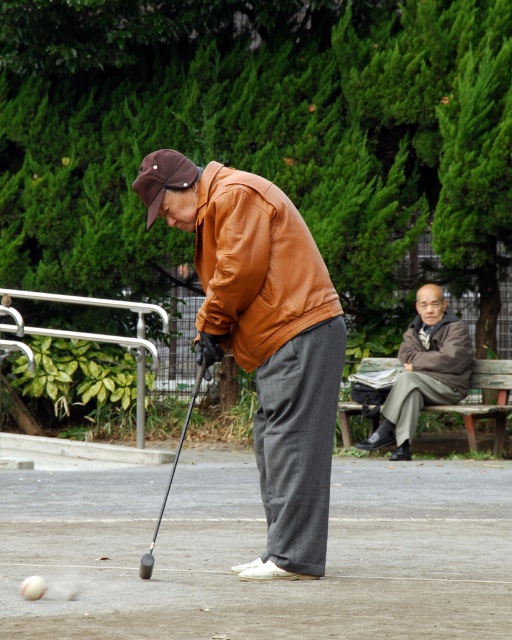
Question: Estimate the real-world distances between objects in this image. Which object is closer to the wooden bench at center right?

Choices:
 (A) brown leather jacket at right
 (B) brown leather jacket at center
 (C) gray fabric jacket at upper right
 (D) black rubber golf club at lower center

Answer: (A)

Question: Which point is farther from the camera taking this photo?

Choices:
 (A) (160, 509)
 (B) (27, 596)
 (C) (209, 253)
 (D) (430, 355)

Answer: (D)

Question: Can you confirm if wooden bench at center right is smaller than black rubber golf club at lower center?

Choices:
 (A) no
 (B) yes

Answer: (B)

Question: Is wooden bench at center right positioned in front of brown leather jacket at right?

Choices:
 (A) yes
 (B) no

Answer: (A)

Question: Which object is farther from the camera taking this photo?

Choices:
 (A) wooden bench at center right
 (B) brown leather jacket at right
 (C) black rubber golf club at lower center
 (D) white matte golf ball at lower left

Answer: (B)

Question: Observing the image, what is the correct spatial positioning of wooden bench at center right in reference to black rubber golf club at lower center?

Choices:
 (A) below
 (B) above

Answer: (B)